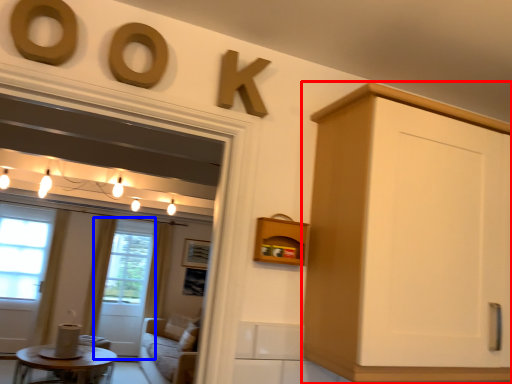
Question: Among these objects, which one is farthest to the camera, cabinetry (highlighted by a red box) or screen door (highlighted by a blue box)?

Choices:
 (A) cabinetry
 (B) screen door

Answer: (B)